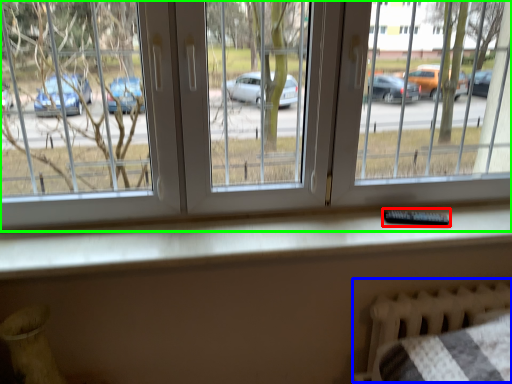
Question: Estimate the real-world distances between objects in this image. Which object is farther from remote (highlighted by a red box), bed frame (highlighted by a blue box) or window (highlighted by a green box)?

Choices:
 (A) bed frame
 (B) window

Answer: (B)